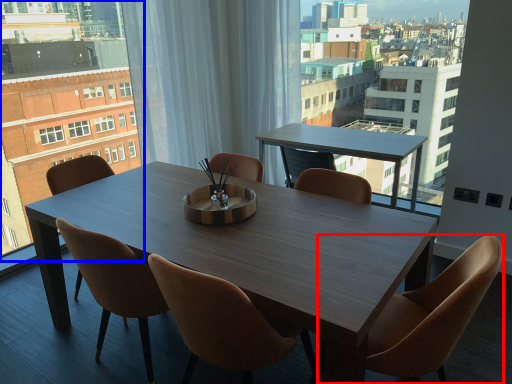
Question: Among these objects, which one is farthest to the camera, chair (highlighted by a red box) or condominium (highlighted by a blue box)?

Choices:
 (A) chair
 (B) condominium

Answer: (B)